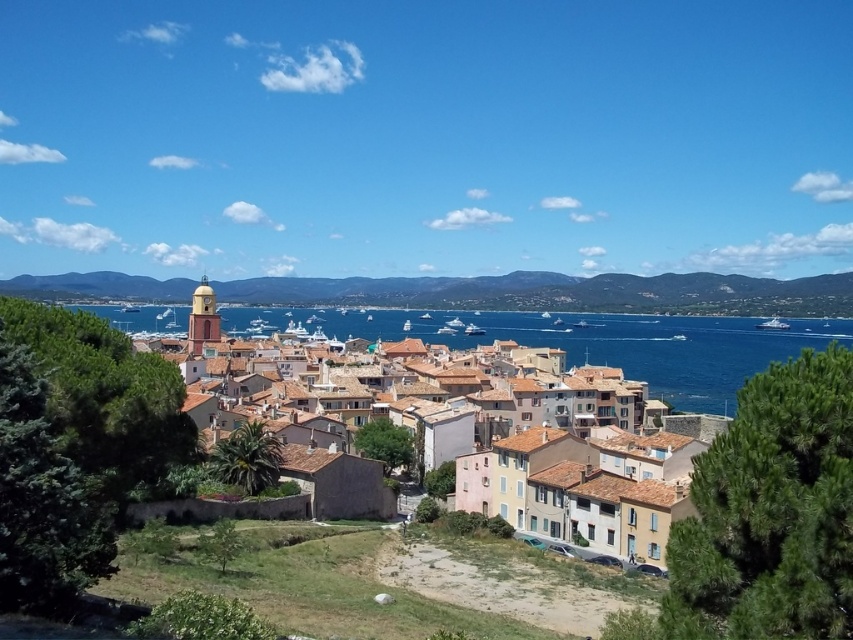
Is blue water at center thinner than multicolored tiled roofs at center?

In fact, blue water at center might be wider than multicolored tiled roofs at center.

Is blue water at center further to camera compared to multicolored tiled roofs at center?

Yes, blue water at center is further from the viewer.

Find the location of `blue water at center`. blue water at center is located at coordinates (625, 346).

This screenshot has height=640, width=853. Identify the location of blue water at center. (625, 346).

Which is more to the right, green grassy hillside at center or multicolored tiled roofs at center?

From the viewer's perspective, green grassy hillside at center appears more on the right side.

Is green grassy hillside at center smaller than multicolored tiled roofs at center?

Yes.

The height and width of the screenshot is (640, 853). I want to click on green grassy hillside at center, so click(560, 292).

Which is below, green grassy hillside at center or blue water at center?

blue water at center

Does green grassy hillside at center have a lesser height compared to blue water at center?

Correct, green grassy hillside at center is not as tall as blue water at center.

Between point (424, 280) and point (358, 328), which one is positioned in front?

Point (358, 328) is more forward.

Identify the location of green grassy hillside at center. (560, 292).